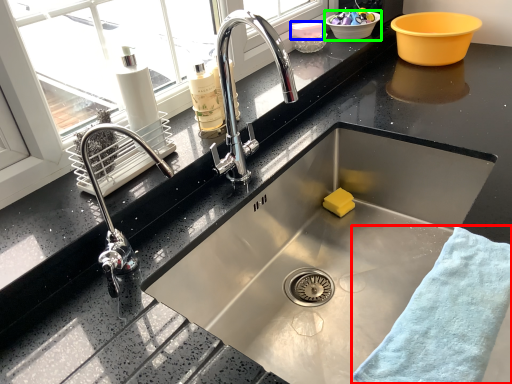
Question: Based on their relative distances, which object is nearer to bath towel (highlighted by a red box)? Choose from basin (highlighted by a blue box) and basin (highlighted by a green box).

Choices:
 (A) basin
 (B) basin

Answer: (A)